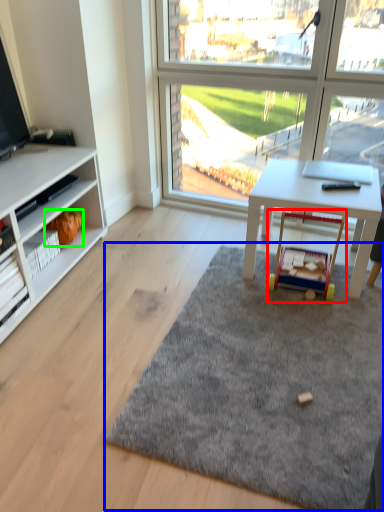
Question: Which object is positioned closest to toy (highlighted by a red box)? Select from mat (highlighted by a blue box) and toy (highlighted by a green box).

Choices:
 (A) mat
 (B) toy

Answer: (A)